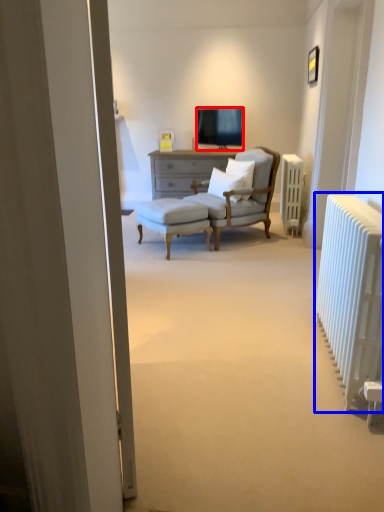
Question: Which point is further to the camera, television (highlighted by a red box) or radiator (highlighted by a blue box)?

Choices:
 (A) television
 (B) radiator

Answer: (A)